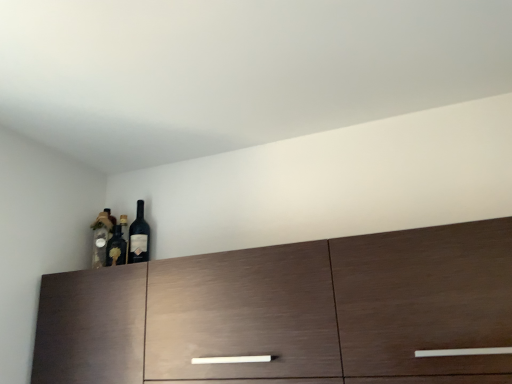
Question: From the image's perspective, is matte glass wine bottle at upper left on top of dark wood cabinet at center?

Choices:
 (A) yes
 (B) no

Answer: (A)

Question: Considering the relative sizes of matte glass wine bottle at upper left and dark wood cabinet at center in the image provided, is matte glass wine bottle at upper left smaller than dark wood cabinet at center?

Choices:
 (A) yes
 (B) no

Answer: (A)

Question: Is matte glass wine bottle at upper left not within dark wood cabinet at center?

Choices:
 (A) yes
 (B) no

Answer: (A)

Question: Is dark wood cabinet at center completely or partially inside matte glass wine bottle at upper left?

Choices:
 (A) yes
 (B) no

Answer: (B)

Question: Is matte glass wine bottle at upper left far from dark wood cabinet at center?

Choices:
 (A) yes
 (B) no

Answer: (B)

Question: From the image's perspective, is matte glass wine bottle at upper left under dark wood cabinet at center?

Choices:
 (A) yes
 (B) no

Answer: (B)

Question: Is the depth of matte glass bottle at left less than that of dark wood cabinet at center?

Choices:
 (A) yes
 (B) no

Answer: (B)

Question: Considering the relative positions of matte glass bottle at left and dark wood cabinet at center in the image provided, is matte glass bottle at left behind dark wood cabinet at center?

Choices:
 (A) yes
 (B) no

Answer: (A)

Question: Is dark wood cabinet at center surrounded by matte glass bottle at left?

Choices:
 (A) yes
 (B) no

Answer: (B)

Question: From the image's perspective, would you say matte glass bottle at left is shown under dark wood cabinet at center?

Choices:
 (A) yes
 (B) no

Answer: (B)

Question: Is matte glass bottle at left facing towards dark wood cabinet at center?

Choices:
 (A) no
 (B) yes

Answer: (A)

Question: Does matte glass bottle at left have a lesser width compared to dark wood cabinet at center?

Choices:
 (A) no
 (B) yes

Answer: (B)

Question: Can you confirm if dark wood cabinet at center is positioned to the right of matte glass bottle at left?

Choices:
 (A) no
 (B) yes

Answer: (B)